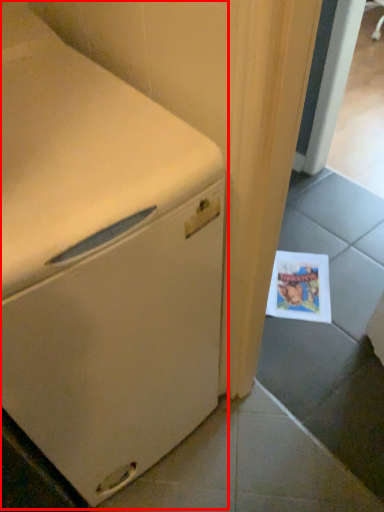
Question: From the image's perspective, where is home appliance (annotated by the red box) located in relation to postcard in the image?

Choices:
 (A) above
 (B) below

Answer: (A)